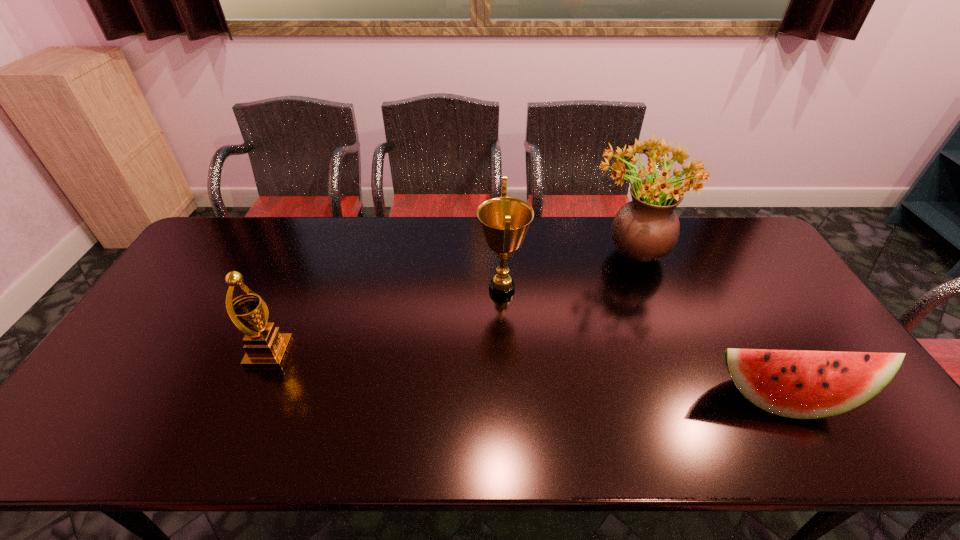
I want to click on flower arrangement, so coord(646,229).

Identify the location of the third object from right to left. (504, 221).

In order to click on the right award in this screenshot , I will do `click(504, 221)`.

Identify the location of the left award. The height and width of the screenshot is (540, 960). pos(266,347).

Locate an element on the screen. This screenshot has width=960, height=540. the shorter award is located at coordinates (266, 347).

Image resolution: width=960 pixels, height=540 pixels. In order to click on watermelon in this screenshot , I will do `click(800, 384)`.

Locate an element on the screen. This screenshot has width=960, height=540. the shortest object is located at coordinates (800, 384).

Where is `free space located 0.080m on the front of the flower arrangement`? The image size is (960, 540). free space located 0.080m on the front of the flower arrangement is located at coordinates (646, 296).

In order to click on free space located 0.340m on the front view with handles of the farther award in this screenshot , I will do `click(366, 289)`.

Find the location of a particular element. free space located 0.050m on the front view with handles of the farther award is located at coordinates (461, 289).